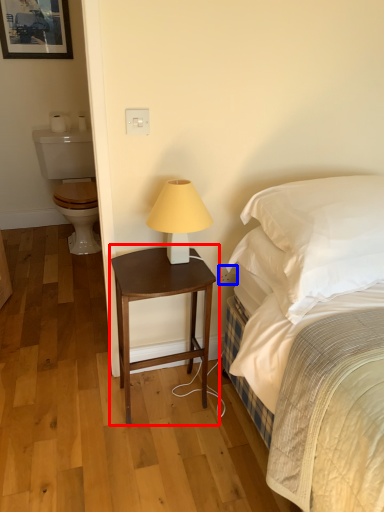
Question: Which object is further to the camera taking this photo, nightstand (highlighted by a red box) or electric outlet (highlighted by a blue box)?

Choices:
 (A) nightstand
 (B) electric outlet

Answer: (B)